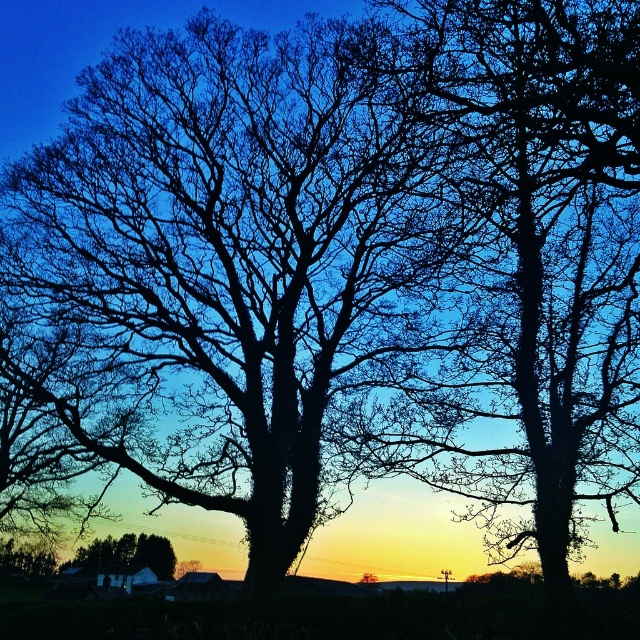
Does silhouette bark tree at center appear under smooth brown house at lower center?

No, silhouette bark tree at center is not below smooth brown house at lower center.

The image size is (640, 640). Describe the element at coordinates (500, 266) in the screenshot. I see `silhouette bark tree at center` at that location.

Where is `silhouette bark tree at center`? This screenshot has height=640, width=640. silhouette bark tree at center is located at coordinates (500, 266).